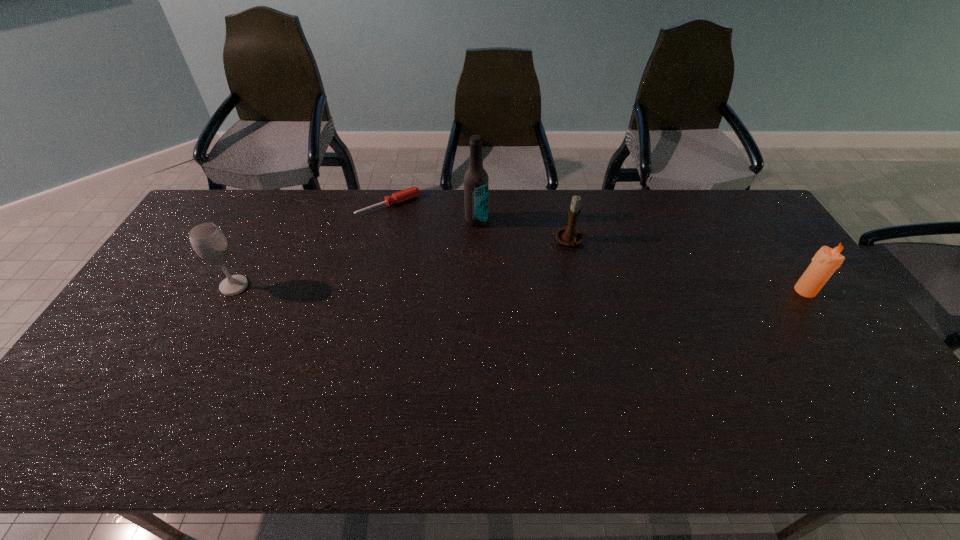
Locate an element on the screen. The width and height of the screenshot is (960, 540). vacant space located on the label of the beer bottle is located at coordinates (465, 319).

Identify the location of free space located 0.140m on the label of the beer bottle. This screenshot has width=960, height=540. (472, 255).

This screenshot has width=960, height=540. I want to click on free spot located on the label of the beer bottle, so click(x=468, y=300).

I want to click on free region located on the side of the second object from right to left with the handle, so click(x=572, y=272).

Locate an element on the screen. This screenshot has height=540, width=960. free space located 0.150m on the side of the second object from right to left with the handle is located at coordinates (573, 288).

You are a GUI agent. You are given a task and a screenshot of the screen. Output one action in this format:
    pyautogui.click(x=<x>, y=<y>)
    Task: Click on the free location located 0.280m on the side of the second object from right to left with the handle
    The width and height of the screenshot is (960, 540).
    Given the screenshot: What is the action you would take?
    pyautogui.click(x=576, y=322)

Identify the location of vacant region located 0.100m at the tip of the screwdriver. The height and width of the screenshot is (540, 960). (416, 231).

Find the location of a particular element. vacant position located 0.400m at the tip of the screwdriver is located at coordinates (461, 285).

Find the location of `blank space located 0.210m at the tip of the screwdriver`. blank space located 0.210m at the tip of the screwdriver is located at coordinates (431, 249).

Find the location of `beer bottle that is at the far edge`. beer bottle that is at the far edge is located at coordinates (476, 180).